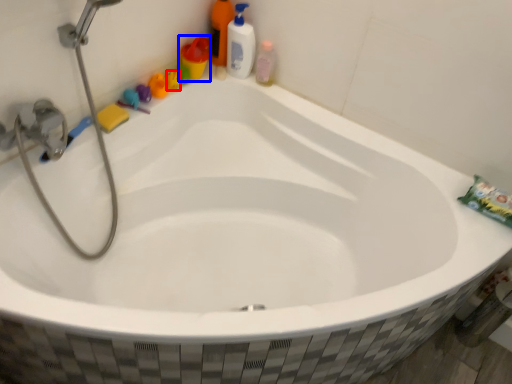
Question: Which of the following is the closest to the observer, toy (highlighted by a red box) or toiletry (highlighted by a blue box)?

Choices:
 (A) toy
 (B) toiletry

Answer: (B)